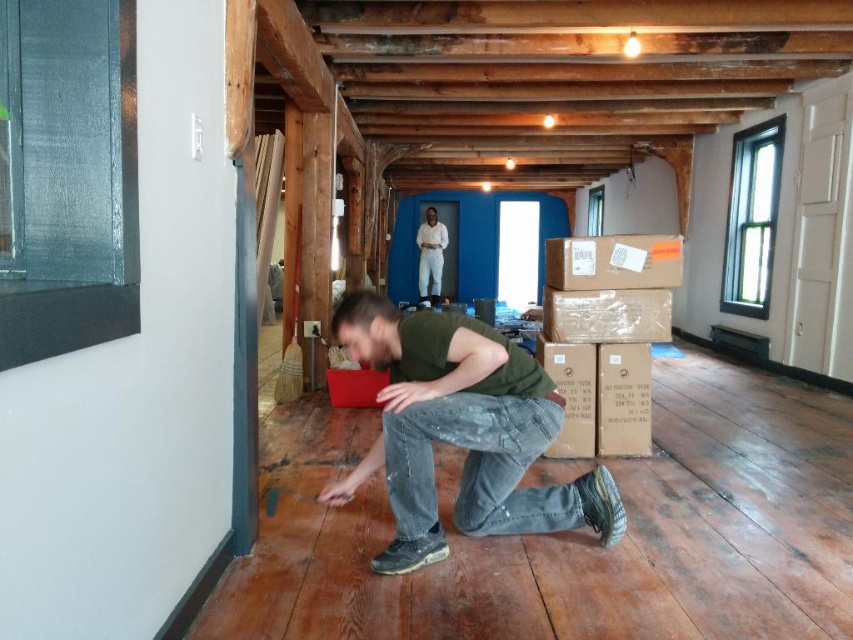
Does green cotton shirt at center have a smaller size compared to matte brown cardboard box at center?

Actually, green cotton shirt at center might be larger than matte brown cardboard box at center.

Which of these two, green cotton shirt at center or matte brown cardboard box at center, stands shorter?

With less height is matte brown cardboard box at center.

Which is in front, point (505, 387) or point (589, 332)?

Point (505, 387) is more forward.

Find the location of a particular element. The width and height of the screenshot is (853, 640). green cotton shirt at center is located at coordinates (461, 433).

Which is above, matte brown cardboard box at right or matte brown cardboard box at center?

matte brown cardboard box at right is above.

Looking at this image, is matte brown cardboard box at right bigger than matte brown cardboard box at center?

Incorrect, matte brown cardboard box at right is not larger than matte brown cardboard box at center.

Does point (671, 282) come farther from viewer compared to point (579, 323)?

No, it is not.

You are a GUI agent. You are given a task and a screenshot of the screen. Output one action in this format:
    pyautogui.click(x=<x>, y=<y>)
    Task: Click on the matte brown cardboard box at right
    
    Given the screenshot: What is the action you would take?
    pyautogui.click(x=613, y=262)

Is the position of matte brown cardboard box at center less distant than that of white cotton shirt at center?

Yes, it is.

Which is in front, point (660, 305) or point (436, 256)?

Point (660, 305) is more forward.

The height and width of the screenshot is (640, 853). Find the location of `matte brown cardboard box at center`. matte brown cardboard box at center is located at coordinates (607, 316).